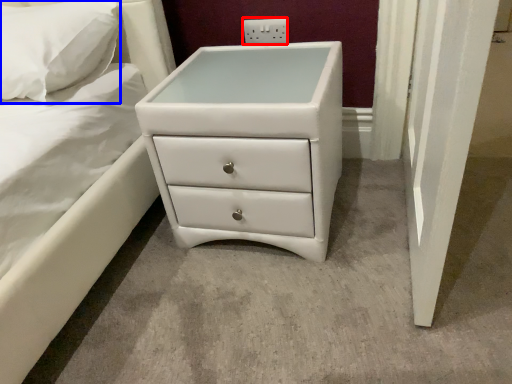
Question: Among these objects, which one is farthest to the camera, electric outlet (highlighted by a red box) or pillow (highlighted by a blue box)?

Choices:
 (A) electric outlet
 (B) pillow

Answer: (A)